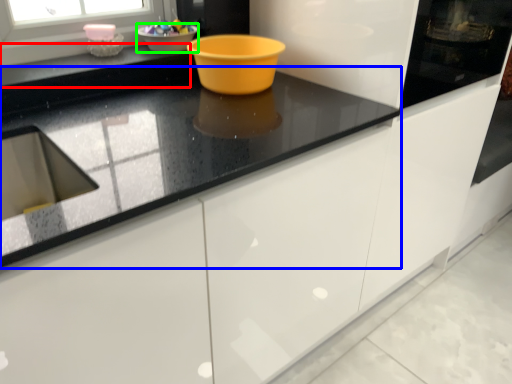
Question: Which is farther away from counter top (highlighted by a red box)? countertop (highlighted by a blue box) or basin (highlighted by a green box)?

Choices:
 (A) countertop
 (B) basin

Answer: (A)